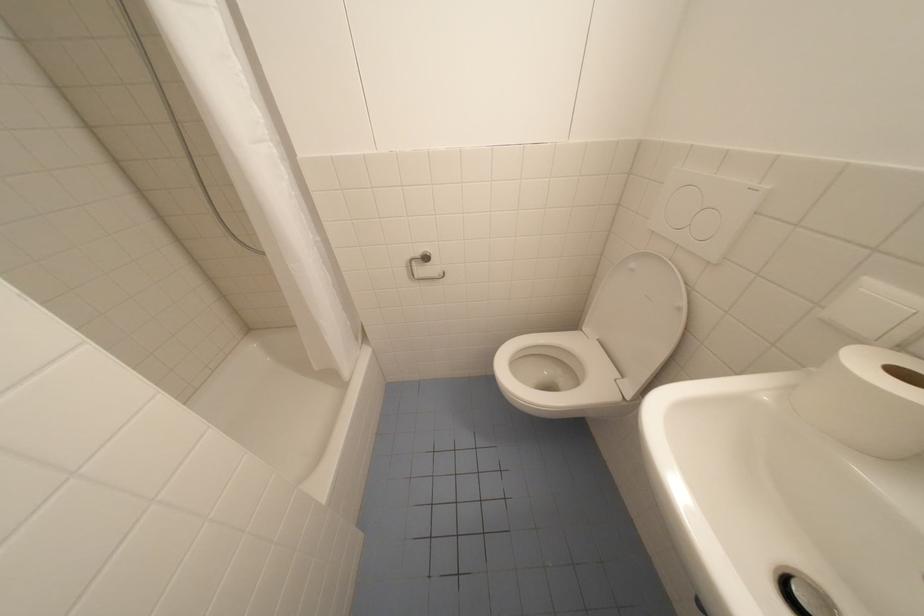
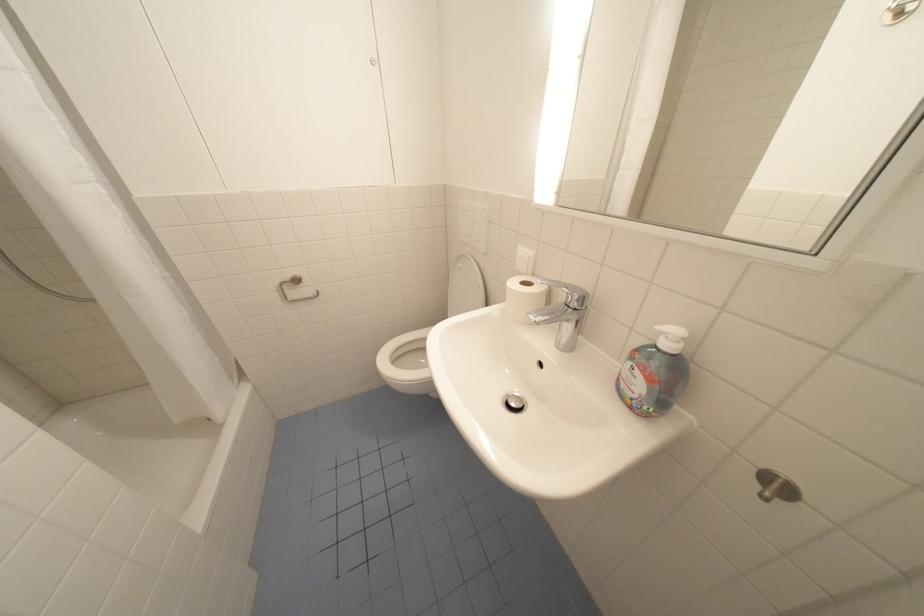
Question: I am providing you with two images of the same scene from different viewpoints. Please identify which objects are invisible in image2.

Choices:
 (A) chrome faucet handle
 (B) toilet paper holder
 (C) toilet flush buttons
 (D) none of these

Answer: (D)